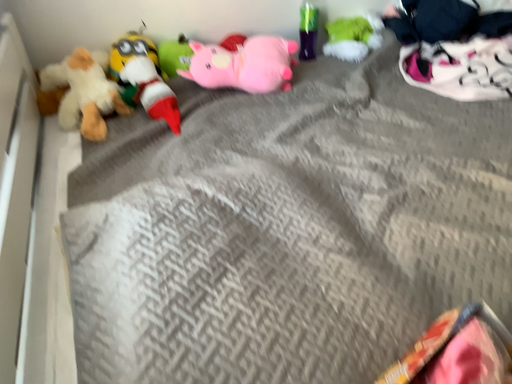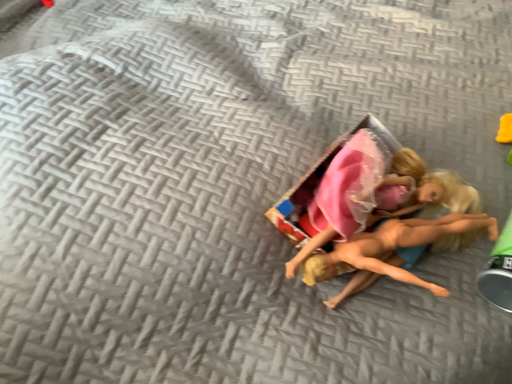
Question: How did the camera likely rotate when shooting the video?

Choices:
 (A) rotated right
 (B) rotated left

Answer: (A)